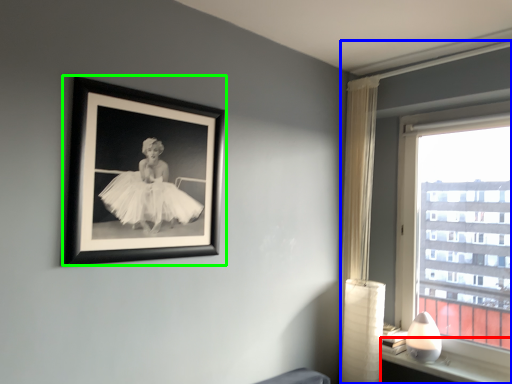
Question: Estimate the real-world distances between objects in this image. Which object is closer to window sill (highlighted by a red box), window (highlighted by a blue box) or picture frame (highlighted by a green box)?

Choices:
 (A) window
 (B) picture frame

Answer: (A)